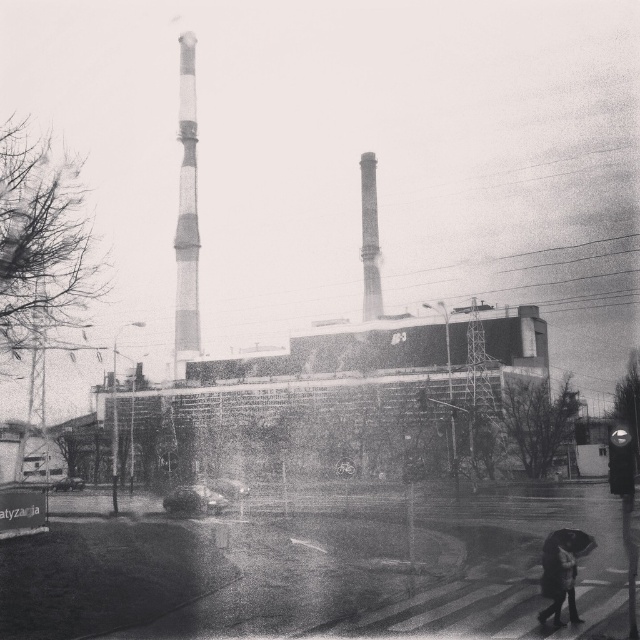
You are a photographer standing in front of the smooth concrete chimney at center and the transparent plastic umbrella at lower right. You want to take a photo that includes both objects. Which object should you move closer to in order to have both in focus without changing the camera settings?

You should move closer to the transparent plastic umbrella at lower right because the smooth concrete chimney at center is further away than the transparent plastic umbrella at lower right, so adjusting your position to the closer object will help keep both in focus.

Consider the image. You are a photographer standing on the wet road in the image. You want to capture a photo of both the smooth concrete chimney at center and the dark textured coat at lower right in the same frame. Which object should you zoom in on to ensure both are visible without moving the camera?

You should zoom in on the dark textured coat at lower right because the smooth concrete chimney at center is wider than the dark textured coat at lower right, so zooming in on the narrower object allows both to fit in the frame.

You are standing on the wet road in the image. Which object, the smooth concrete chimney at center or the dark textured coat at lower right, is closer to your left side?

The dark textured coat at lower right is closer to your left side because the smooth concrete chimney at center is to the right of it.